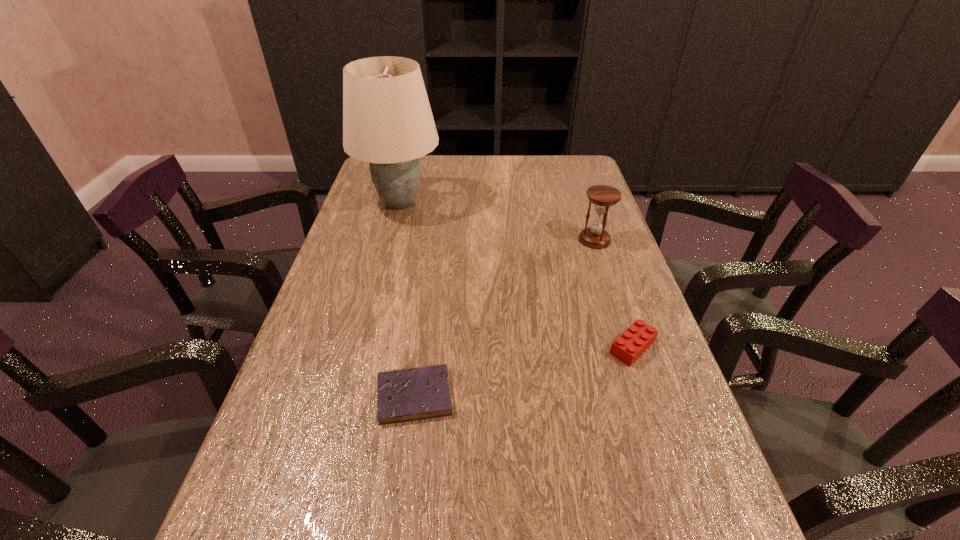
Locate an element on the screen. This screenshot has width=960, height=540. vacant space at the far right corner is located at coordinates (544, 171).

Image resolution: width=960 pixels, height=540 pixels. I want to click on vacant space that is in between the lampshade and the second nearest object, so click(x=516, y=275).

The image size is (960, 540). Find the location of `unoccupied area between the Lego and the second farthest object`. unoccupied area between the Lego and the second farthest object is located at coordinates (613, 294).

Where is `vacant space that is in between the shortest object and the farthest object`? The image size is (960, 540). vacant space that is in between the shortest object and the farthest object is located at coordinates (407, 299).

This screenshot has height=540, width=960. Identify the location of free space between the tallest object and the nearest object. (407, 299).

Where is `free space that is in between the nearest object and the hourglass`? The width and height of the screenshot is (960, 540). free space that is in between the nearest object and the hourglass is located at coordinates (505, 318).

I want to click on blank region between the third tallest object and the shortest object, so click(x=523, y=372).

You are a GUI agent. You are given a task and a screenshot of the screen. Output one action in this format:
    pyautogui.click(x=<x>, y=<y>)
    Task: Click on the vacant area that lies between the Lego and the second farthest object
    This screenshot has width=960, height=540.
    Given the screenshot: What is the action you would take?
    pyautogui.click(x=613, y=294)

Image resolution: width=960 pixels, height=540 pixels. Identify the location of free space between the third farthest object and the nearest object. (523, 372).

Image resolution: width=960 pixels, height=540 pixels. Identify the location of vacant area between the nearest object and the second tallest object. (505, 318).